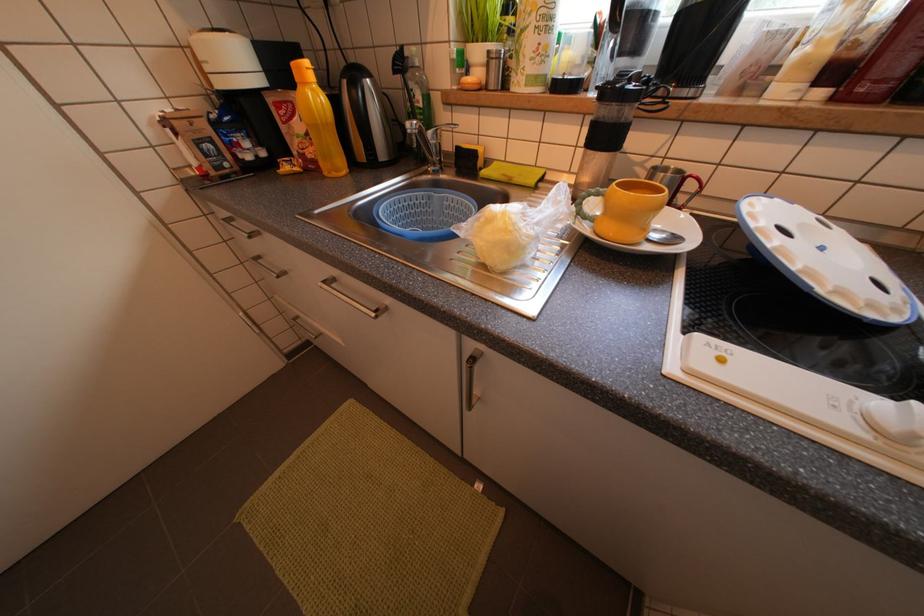
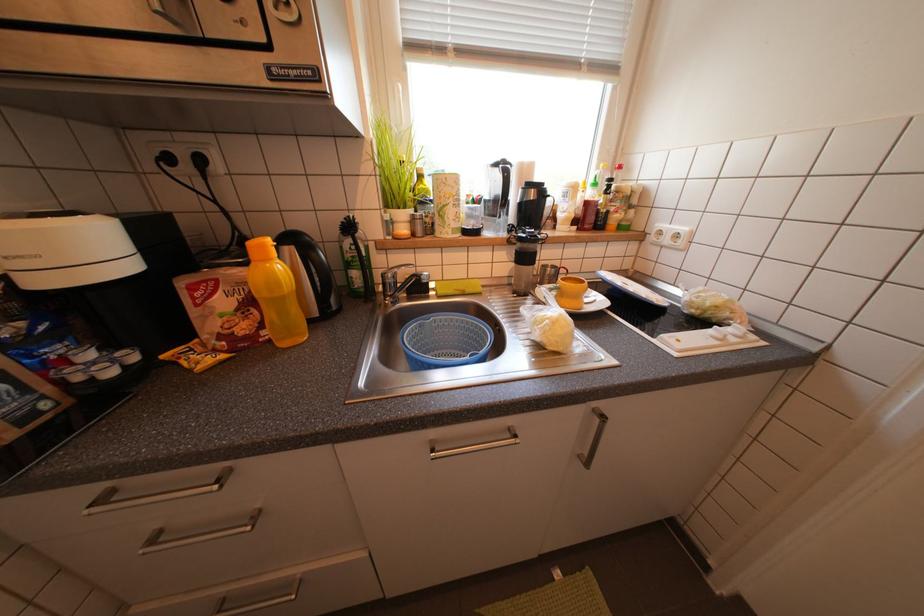
Question: The camera is either moving clockwise (left) or counter-clockwise (right) around the object. The first image is from the beginning of the video and the second image is from the end. Is the camera moving left or right when shooting the video?

Choices:
 (A) Left
 (B) Right

Answer: (A)